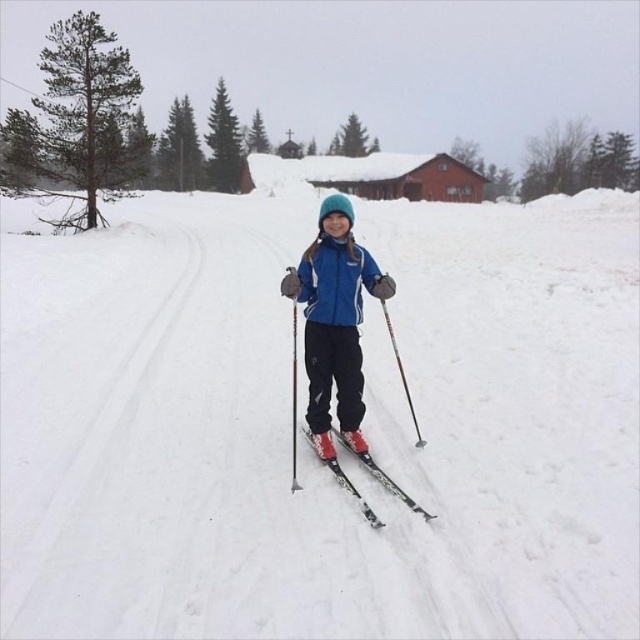
You are a drone operator trying to capture aerial footage of the winter scene. You have two points marked on your map for camera placement. Point A is at coordinates point (60, 504) and Point B is at point (296, 428). Based on the scene description, which point would be closer to the camera if it were positioned to film the skier?

Point A at coordinates point (60, 504) is in front of point B at point (296, 428), so the camera positioned at Point A would be closer to the skier.

You are a photographer planning to take a closeup shot of the shiny black skis at center. However, you notice the white matte snow at center is blocking your view. Can you determine which object is closer to the camera based on the scene description?

The white matte snow at center is positioned over shiny black skis at center, so the white matte snow at center is closer to the camera.